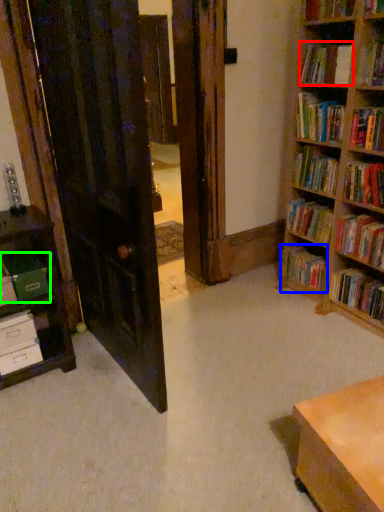
Question: Considering the real-world distances, which object is closest to book (highlighted by a red box)? book (highlighted by a blue box) or paperback book (highlighted by a green box).

Choices:
 (A) book
 (B) paperback book

Answer: (A)